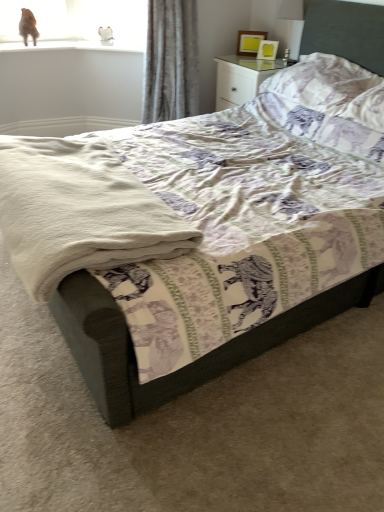
Question: Is brown fur cat at upper left at the back of purple printed pillow at upper right?

Choices:
 (A) yes
 (B) no

Answer: (B)

Question: Is purple printed pillow at upper right next to brown fur cat at upper left?

Choices:
 (A) no
 (B) yes

Answer: (A)

Question: From a real-world perspective, is purple printed pillow at upper right located beneath brown fur cat at upper left?

Choices:
 (A) no
 (B) yes

Answer: (B)

Question: Is the depth of purple printed pillow at upper right greater than that of brown fur cat at upper left?

Choices:
 (A) no
 (B) yes

Answer: (A)

Question: Is purple printed pillow at upper right at the right side of brown fur cat at upper left?

Choices:
 (A) no
 (B) yes

Answer: (B)

Question: Would you say gray velvet curtain at upper center is inside or outside white glossy nightstand at upper right?

Choices:
 (A) outside
 (B) inside

Answer: (A)

Question: In terms of size, does gray velvet curtain at upper center appear bigger or smaller than white glossy nightstand at upper right?

Choices:
 (A) big
 (B) small

Answer: (A)

Question: From a real-world perspective, relative to white glossy nightstand at upper right, is gray velvet curtain at upper center vertically above or below?

Choices:
 (A) below
 (B) above

Answer: (B)

Question: Considering the positions of gray velvet curtain at upper center and white glossy nightstand at upper right in the image, is gray velvet curtain at upper center wider or thinner than white glossy nightstand at upper right?

Choices:
 (A) wide
 (B) thin

Answer: (B)

Question: Visually, is brown fur cat at upper left positioned to the left or to the right of white glossy nightstand at upper right?

Choices:
 (A) right
 (B) left

Answer: (B)

Question: Considering their positions, is brown fur cat at upper left located in front of or behind white glossy nightstand at upper right?

Choices:
 (A) behind
 (B) front

Answer: (A)

Question: From their relative heights in the image, would you say brown fur cat at upper left is taller or shorter than white glossy nightstand at upper right?

Choices:
 (A) tall
 (B) short

Answer: (B)

Question: Is point (21, 27) positioned closer to the camera than point (243, 86)?

Choices:
 (A) closer
 (B) farther

Answer: (B)

Question: From a real-world perspective, is gray velvet curtain at upper center physically located above or below matte yellow picture frame at upper right?

Choices:
 (A) above
 (B) below

Answer: (B)

Question: Visually, is gray velvet curtain at upper center positioned to the left or to the right of matte yellow picture frame at upper right?

Choices:
 (A) right
 (B) left

Answer: (B)